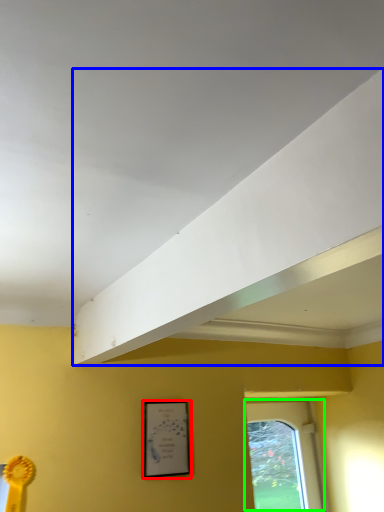
Question: Based on their relative distances, which object is farther from picture frame (highlighted by a red box)? Choose from exhaust hood (highlighted by a blue box) and window (highlighted by a green box).

Choices:
 (A) exhaust hood
 (B) window

Answer: (B)